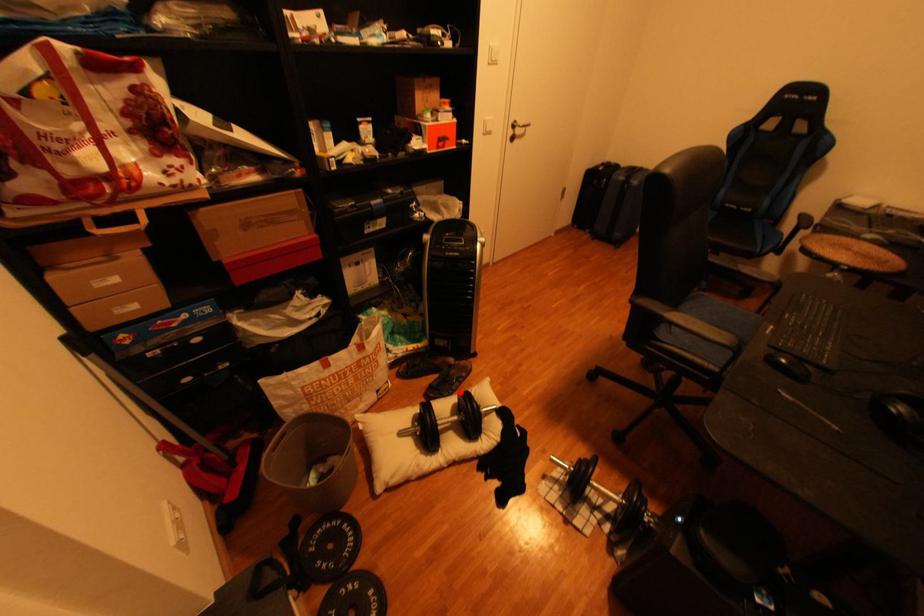
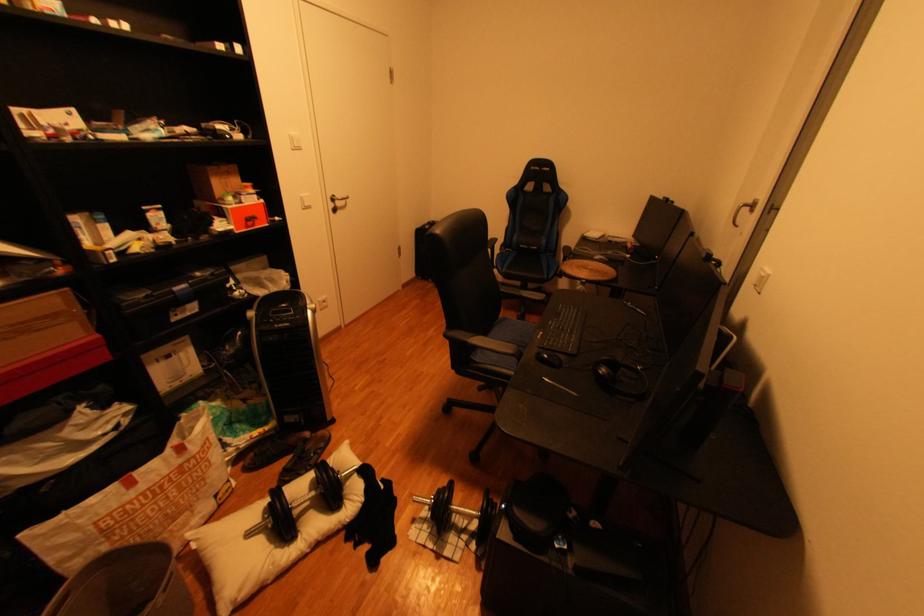
Question: I am providing you with two images of the same scene from different viewpoints. Given a red point in image1, look at the same physical point in image2. Is it:

Choices:
 (A) Closer to the viewpoint
 (B) Farther from the viewpoint

Answer: (A)